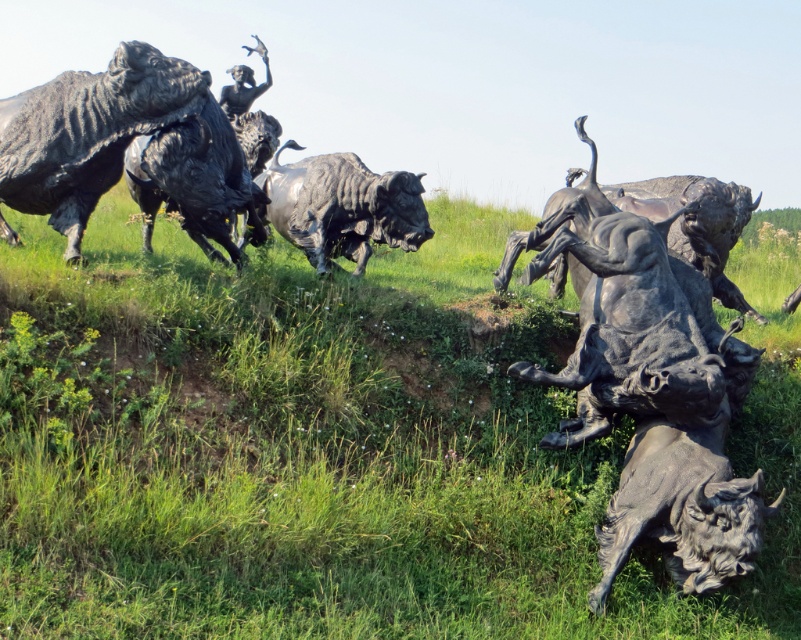
Question: Does bronze textured bison at center have a larger size compared to bronze textured bison at left?

Choices:
 (A) no
 (B) yes

Answer: (B)

Question: Which object is farther from the camera taking this photo?

Choices:
 (A) bronze textured bison at left
 (B) polished bronze bull at center
 (C) green grass at center
 (D) bronze textured bison at center

Answer: (B)

Question: Which object is the closest to the polished bronze bull at center?

Choices:
 (A) bronze textured bison at left
 (B) green grass at center

Answer: (B)

Question: Which is nearer to the polished bronze bull at center?

Choices:
 (A) green grass at center
 (B) bronze textured bison at center
 (C) bronze textured bison at left

Answer: (B)

Question: Does green grass at center have a greater width compared to bronze textured bison at left?

Choices:
 (A) yes
 (B) no

Answer: (A)

Question: Does green grass at center appear on the right side of polished bronze bull at center?

Choices:
 (A) yes
 (B) no

Answer: (A)